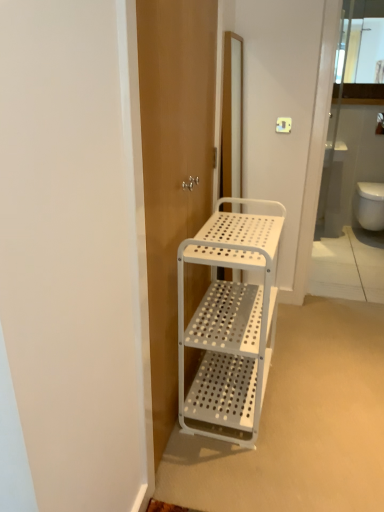
Question: Is white perforated cabinet at upper center far away from white perforated screen door at center?

Choices:
 (A) yes
 (B) no

Answer: (A)

Question: Considering the relative sizes of white perforated cabinet at upper center and white perforated screen door at center in the image provided, is white perforated cabinet at upper center taller than white perforated screen door at center?

Choices:
 (A) no
 (B) yes

Answer: (A)

Question: Is white perforated cabinet at upper center surrounding white perforated screen door at center?

Choices:
 (A) no
 (B) yes

Answer: (A)

Question: Would you say white perforated cabinet at upper center is outside white perforated screen door at center?

Choices:
 (A) no
 (B) yes

Answer: (B)

Question: Does white perforated cabinet at upper center have a greater width compared to white perforated screen door at center?

Choices:
 (A) yes
 (B) no

Answer: (B)

Question: Is white perforated cabinet at upper center next to white perforated screen door at center?

Choices:
 (A) no
 (B) yes

Answer: (A)

Question: Could you tell me if white perforated metal cart at center is facing white glossy toilet bowl at lower right?

Choices:
 (A) yes
 (B) no

Answer: (B)

Question: Is white perforated metal cart at center positioned before white glossy toilet bowl at lower right?

Choices:
 (A) no
 (B) yes

Answer: (B)

Question: Is white glossy toilet bowl at lower right at the back of white perforated metal cart at center?

Choices:
 (A) yes
 (B) no

Answer: (B)

Question: From the image's perspective, is white perforated metal cart at center located beneath white glossy toilet bowl at lower right?

Choices:
 (A) no
 (B) yes

Answer: (B)

Question: Is white perforated metal cart at center not near white glossy toilet bowl at lower right?

Choices:
 (A) no
 (B) yes

Answer: (B)

Question: Is white perforated metal cart at center bigger than white glossy toilet bowl at lower right?

Choices:
 (A) yes
 (B) no

Answer: (A)

Question: Is white perforated metal cart at center at the right side of white perforated cabinet at upper center?

Choices:
 (A) yes
 (B) no

Answer: (B)